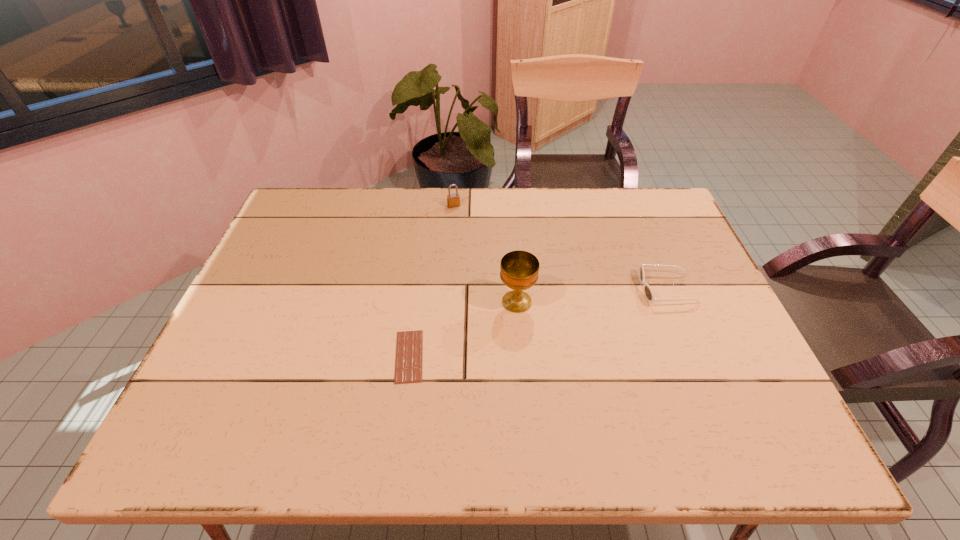
At what (x,y) coordinates should I click in order to perform the action: click on the third closest object to the chocolate bar. Please return your answer as a coordinate pair (x, y). Looking at the image, I should click on (648, 292).

The height and width of the screenshot is (540, 960). Identify the location of object that stands as the second closest to the sunglasses. (409, 348).

You are a GUI agent. You are given a task and a screenshot of the screen. Output one action in this format:
    pyautogui.click(x=<x>, y=<y>)
    Task: Click on the vacant area that satisfies the following two spatial constraints: 1. with the lenses of the sunglasses facing outward; 2. on the front side of the nearest object
    The image size is (960, 540).
    Given the screenshot: What is the action you would take?
    pyautogui.click(x=694, y=356)